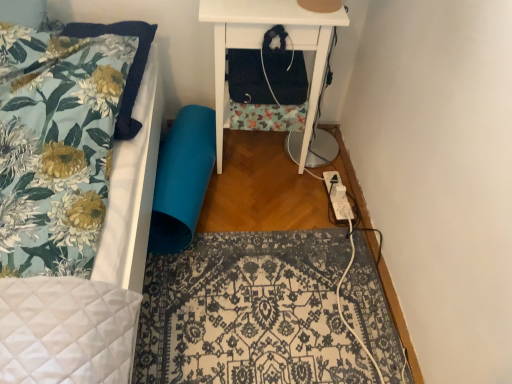
Image resolution: width=512 pixels, height=384 pixels. What are the coordinates of `free spot in front of white plastic extension cord at lower right` in the screenshot? It's located at (334, 235).